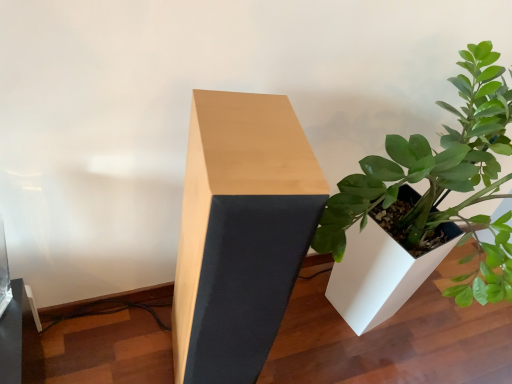
Question: Should I look upward or downward to see light wood/black fabric table at center?

Choices:
 (A) up
 (B) down

Answer: (B)

Question: Is light wood/black fabric table at center at the right side of white matte planter at right?

Choices:
 (A) no
 (B) yes

Answer: (A)

Question: Can you confirm if light wood/black fabric table at center is shorter than white matte planter at right?

Choices:
 (A) no
 (B) yes

Answer: (B)

Question: Does light wood/black fabric table at center have a greater width compared to white matte planter at right?

Choices:
 (A) no
 (B) yes

Answer: (A)

Question: Is light wood/black fabric table at center taller than white matte planter at right?

Choices:
 (A) no
 (B) yes

Answer: (A)

Question: Is light wood/black fabric table at center next to white matte planter at right?

Choices:
 (A) no
 (B) yes

Answer: (A)

Question: Is light wood/black fabric table at center surrounding white matte planter at right?

Choices:
 (A) yes
 (B) no

Answer: (B)

Question: Is white matte planter at right not inside light wood/black fabric table at center?

Choices:
 (A) yes
 (B) no

Answer: (A)

Question: Is white matte planter at right taller than light wood/black fabric table at center?

Choices:
 (A) no
 (B) yes

Answer: (B)

Question: Considering the relative positions of white matte planter at right and light wood/black fabric table at center in the image provided, is white matte planter at right in front of light wood/black fabric table at center?

Choices:
 (A) no
 (B) yes

Answer: (B)

Question: From a real-world perspective, is white matte planter at right located higher than light wood/black fabric table at center?

Choices:
 (A) no
 (B) yes

Answer: (B)

Question: Are white matte planter at right and light wood/black fabric table at center beside each other?

Choices:
 (A) yes
 (B) no

Answer: (B)

Question: Would you consider white matte planter at right to be distant from light wood/black fabric table at center?

Choices:
 (A) yes
 (B) no

Answer: (B)

Question: Considering the positions of white matte planter at right and light wood/black fabric table at center in the image, is white matte planter at right bigger or smaller than light wood/black fabric table at center?

Choices:
 (A) big
 (B) small

Answer: (A)